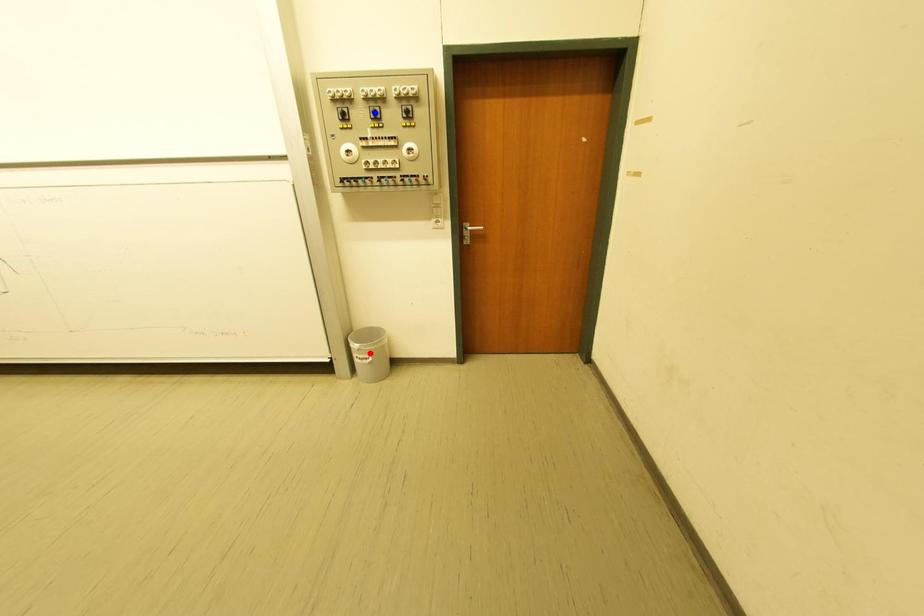
Question: Which of the two points in the image is closer to the camera?

Choices:
 (A) Blue point is closer.
 (B) Red point is closer.

Answer: (A)